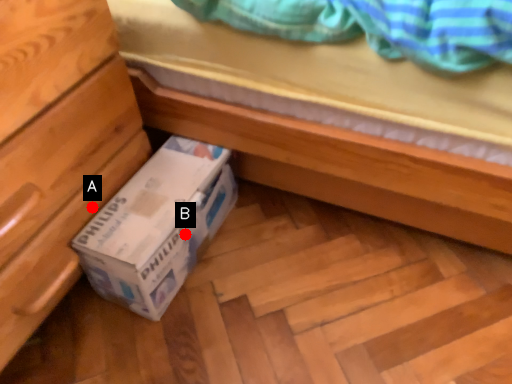
Question: Two points are circled on the image, labeled by A and B beside each circle. Which point appears closest to the camera in this image?

Choices:
 (A) A is closer
 (B) B is closer

Answer: (A)